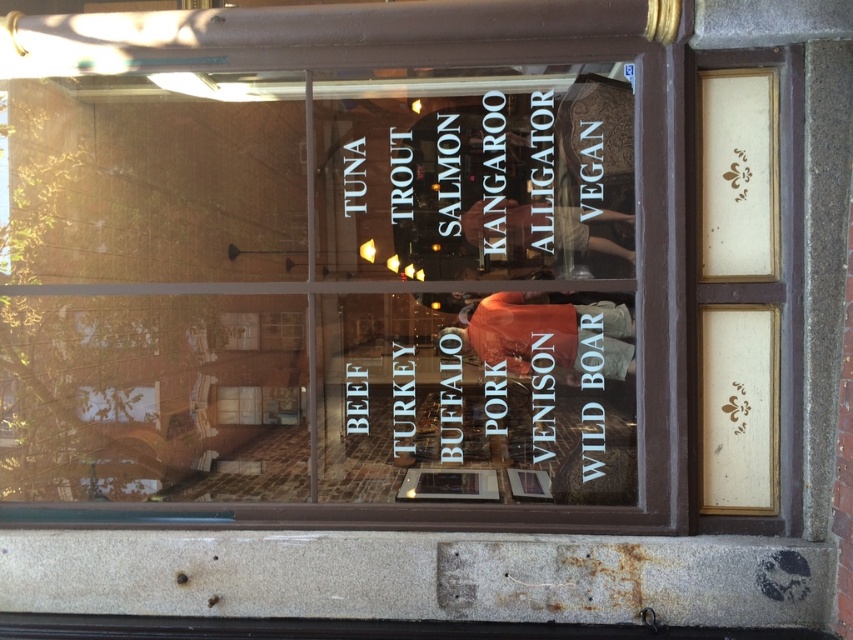
Which is more to the left, transparent glass menu at center or white paper text at center?

transparent glass menu at center is more to the left.

Between transparent glass menu at center and white paper text at center, which one is positioned lower?

white paper text at center

Is point (165, 316) behind point (440, 336)?

Yes.

You are a GUI agent. You are given a task and a screenshot of the screen. Output one action in this format:
    pyautogui.click(x=<x>, y=<y>)
    Task: Click on the transparent glass menu at center
    The image size is (853, 640).
    Given the screenshot: What is the action you would take?
    pyautogui.click(x=318, y=289)

Is transparent glass menu at center closer to camera compared to black paper at upper center?

That is True.

Based on the photo, is transparent glass menu at center to the right of black paper at upper center from the viewer's perspective?

Incorrect, transparent glass menu at center is not on the right side of black paper at upper center.

Does point (505, 76) lie in front of point (357, 156)?

That is True.

Where is `transparent glass menu at center`? transparent glass menu at center is located at coordinates (318, 289).

Based on the photo, does white paper text at center have a lesser height compared to black paper at upper center?

Incorrect, white paper text at center's height does not fall short of black paper at upper center's.

Which is more to the left, white paper text at center or black paper at upper center?

From the viewer's perspective, black paper at upper center appears more on the left side.

Locate an element on the screen. This screenshot has width=853, height=640. white paper text at center is located at coordinates (491, 400).